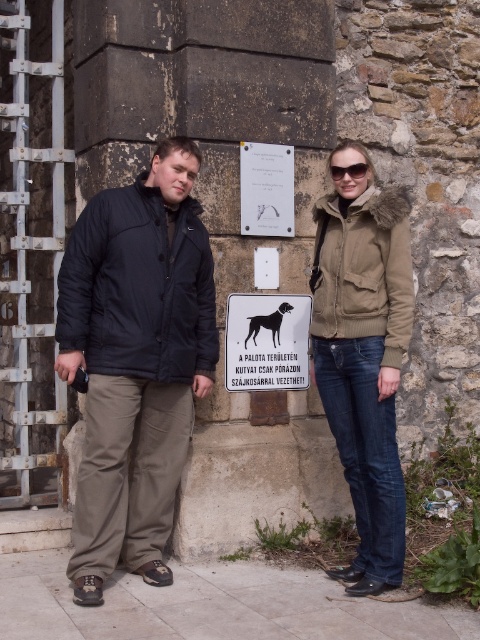
Question: Which of the following is the farthest from the observer?

Choices:
 (A) (266, 358)
 (B) (287, 310)
 (C) (360, 170)

Answer: (B)

Question: Among these objects, which one is nearest to the camera?

Choices:
 (A) black glossy dog at center
 (B) black plastic sign at center

Answer: (B)

Question: Is dark blue jacket at center further to camera compared to black glossy dog at center?

Choices:
 (A) no
 (B) yes

Answer: (A)

Question: Which point is closer to the camera taking this photo?

Choices:
 (A) (332, 166)
 (B) (233, 348)

Answer: (A)

Question: Is black glossy dog at center closer to camera compared to sunglasses at center?

Choices:
 (A) no
 (B) yes

Answer: (A)

Question: Considering the relative positions of dark blue puffy jacket at center and dark blue jacket at center in the image provided, where is dark blue puffy jacket at center located with respect to dark blue jacket at center?

Choices:
 (A) above
 (B) below

Answer: (A)